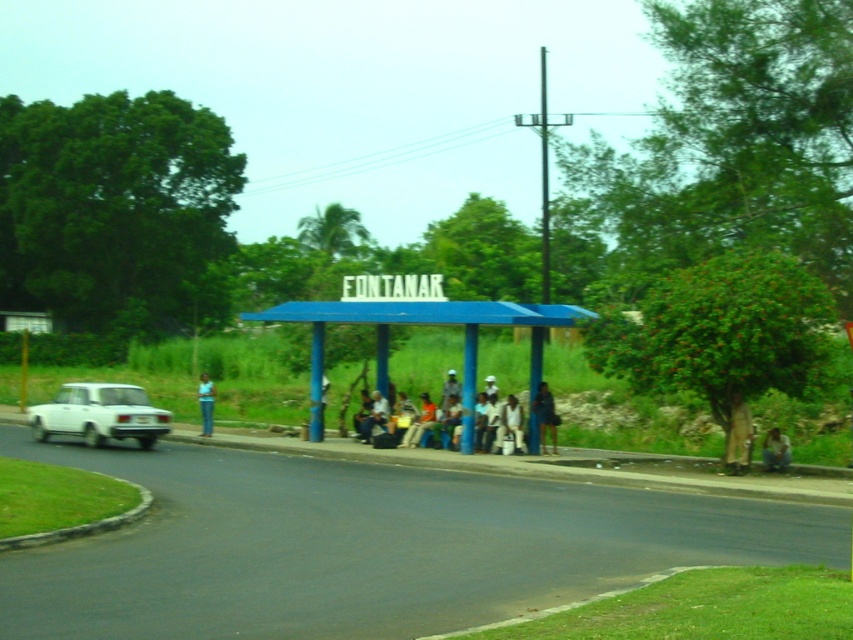
Question: Is blue painted metal bus stop at center below brown leather jacket at lower right?

Choices:
 (A) yes
 (B) no

Answer: (B)

Question: In this image, where is brown leather jacket at lower right located relative to blue jeans at left?

Choices:
 (A) below
 (B) above

Answer: (A)

Question: Which object appears closest to the camera in this image?

Choices:
 (A) dark blue fabric dress at center
 (B) brown leather jacket at lower right
 (C) matte blue bench at center

Answer: (B)

Question: Which point appears farthest from the camera in this image?

Choices:
 (A) (515, 444)
 (B) (86, 401)

Answer: (B)

Question: Can you confirm if blue painted metal bus stop at center is thinner than matte blue bench at center?

Choices:
 (A) no
 (B) yes

Answer: (A)

Question: Which of the following is the farthest from the observer?

Choices:
 (A) matte blue bench at center
 (B) light brown fabric shirt at center
 (C) blue jeans at left
 (D) dark blue fabric dress at center

Answer: (C)